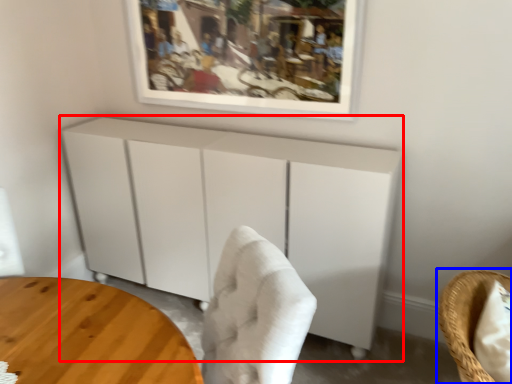
Question: Which of the following is the farthest to the observer, cabinetry (highlighted by a red box) or chair (highlighted by a blue box)?

Choices:
 (A) cabinetry
 (B) chair

Answer: (A)